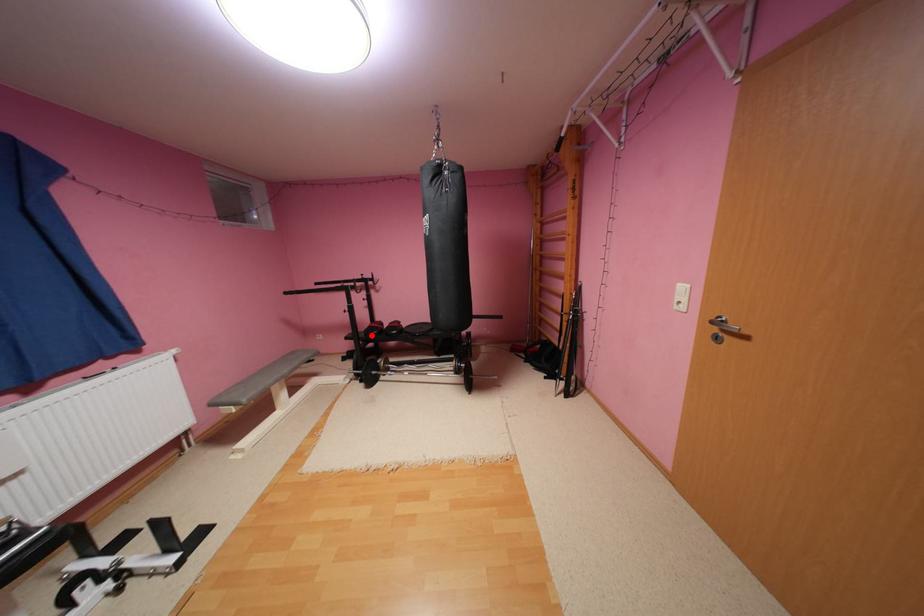
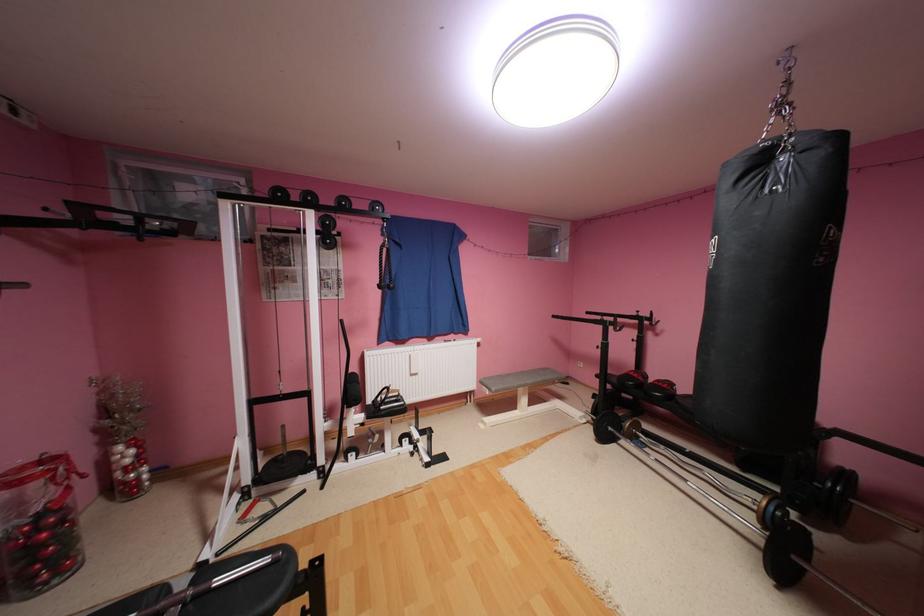
The point at the highlighted location is marked in the first image. Where is the corresponding point in the second image?

(624, 379)